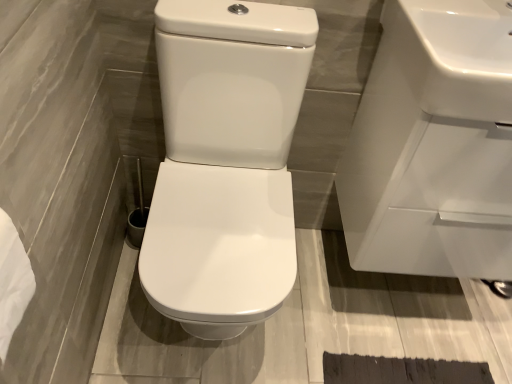
Question: Is white glossy toilet at center aimed at white glossy sink at upper right, arranged as the first sink when viewed from the back?

Choices:
 (A) yes
 (B) no

Answer: (B)

Question: Can you confirm if white glossy toilet at center is smaller than white glossy sink at upper right, arranged as the first sink when viewed from the back?

Choices:
 (A) yes
 (B) no

Answer: (B)

Question: From a real-world perspective, does white glossy toilet at center sit lower than white glossy sink at upper right, positioned as the second sink in front-to-back order?

Choices:
 (A) no
 (B) yes

Answer: (B)

Question: Is white glossy toilet at center surrounding white glossy sink at upper right, positioned as the second sink in front-to-back order?

Choices:
 (A) no
 (B) yes

Answer: (A)

Question: Considering the relative sizes of white glossy toilet at center and white glossy sink at upper right, arranged as the first sink when viewed from the back, in the image provided, is white glossy toilet at center bigger than white glossy sink at upper right, arranged as the first sink when viewed from the back,?

Choices:
 (A) yes
 (B) no

Answer: (A)

Question: From a real-world perspective, is white glossy toilet at center positioned over white glossy sink at upper right, arranged as the first sink when viewed from the back, based on gravity?

Choices:
 (A) no
 (B) yes

Answer: (A)

Question: Can you confirm if white glossy sink at upper right, placed as the first sink when sorted from front to back, is shorter than white paper towel at lower left?

Choices:
 (A) no
 (B) yes

Answer: (A)

Question: Is white glossy sink at upper right, placed as the first sink when sorted from front to back, behind white paper towel at lower left?

Choices:
 (A) yes
 (B) no

Answer: (A)

Question: Does white glossy sink at upper right, acting as the 2th sink starting from the back, touch white paper towel at lower left?

Choices:
 (A) yes
 (B) no

Answer: (B)

Question: Does white glossy sink at upper right, acting as the 2th sink starting from the back, have a larger size compared to white paper towel at lower left?

Choices:
 (A) yes
 (B) no

Answer: (A)

Question: Is white glossy sink at upper right, placed as the first sink when sorted from front to back, facing away from white paper towel at lower left?

Choices:
 (A) yes
 (B) no

Answer: (B)

Question: Considering the relative positions of white glossy sink at upper right, placed as the first sink when sorted from front to back, and white paper towel at lower left in the image provided, is white glossy sink at upper right, placed as the first sink when sorted from front to back, in front of white paper towel at lower left?

Choices:
 (A) no
 (B) yes

Answer: (A)

Question: Is white glossy sink at upper right, placed as the first sink when sorted from front to back, at the right side of white glossy toilet at center?

Choices:
 (A) no
 (B) yes

Answer: (B)